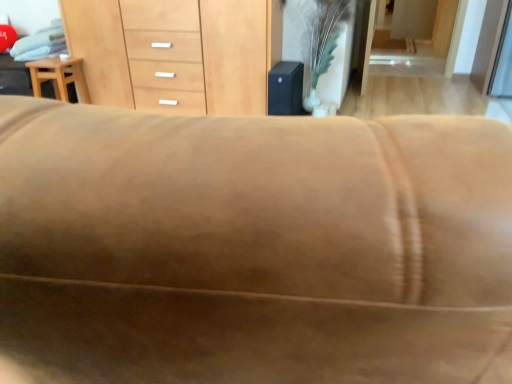
Question: Visually, is light brown wood stool at left positioned to the left or to the right of green leafy plant at center?

Choices:
 (A) left
 (B) right

Answer: (A)

Question: From the image's perspective, relative to green leafy plant at center, is light brown wood stool at left above or below?

Choices:
 (A) below
 (B) above

Answer: (A)

Question: Which is farther from the green leafy plant at center?

Choices:
 (A) light brown wood stool at left
 (B) light brown wood chest of drawers at center

Answer: (A)

Question: Estimate the real-world distances between objects in this image. Which object is farther from the light brown wood chest of drawers at center?

Choices:
 (A) green leafy plant at center
 (B) light brown wood stool at left

Answer: (A)